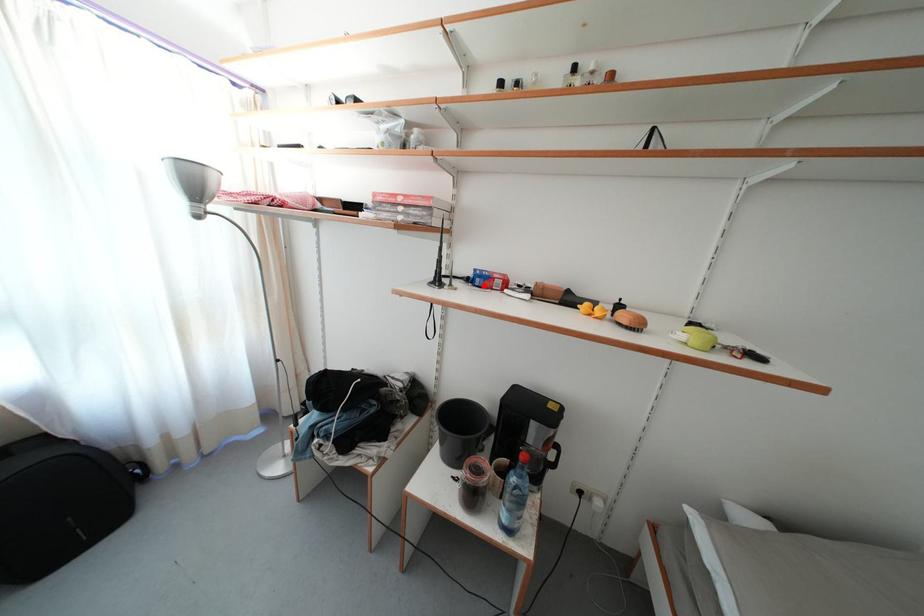
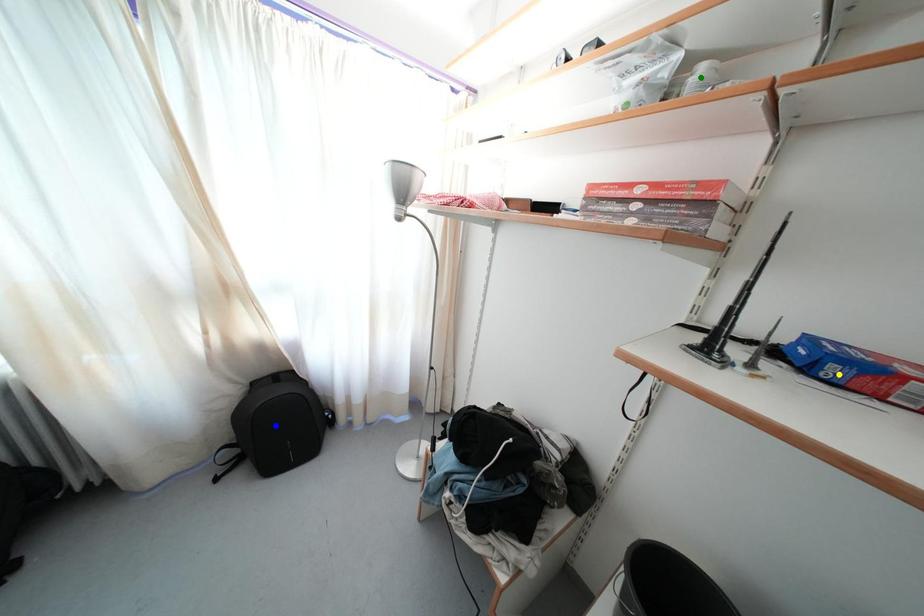
Question: I am providing you with two images of the same scene from different viewpoints. A red point is marked on the first image. You are given multiple points on the second image. Which spot in image 2 lines up with the point in image 1?

Choices:
 (A) yellow point
 (B) green point
 (C) blue point

Answer: (A)